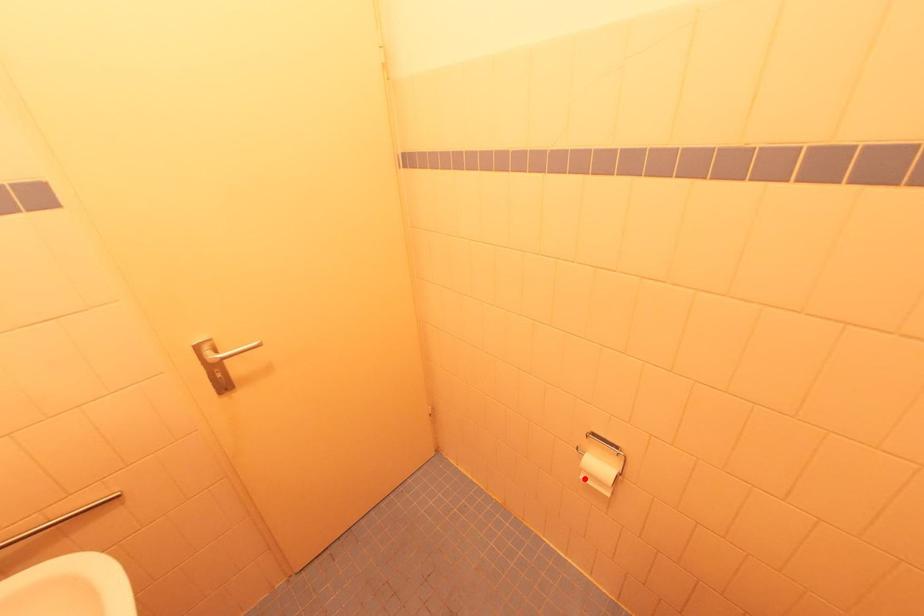
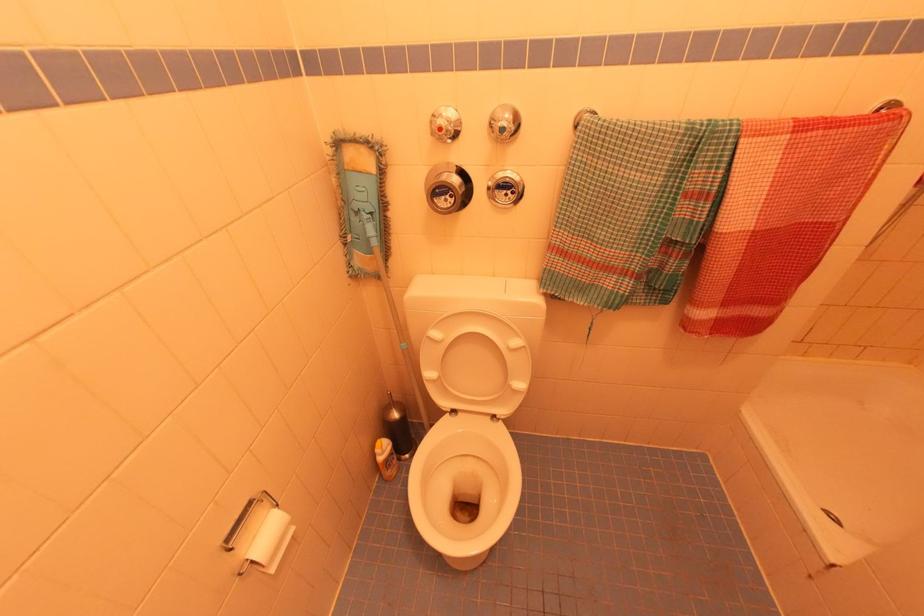
Question: I am providing you with two images of the same scene from different viewpoints. Image1 has a red point marked. In image2, the corresponding 3D location appears at what relative position? Reply with the corresponding letter.

Choices:
 (A) Closer
 (B) Farther

Answer: (A)